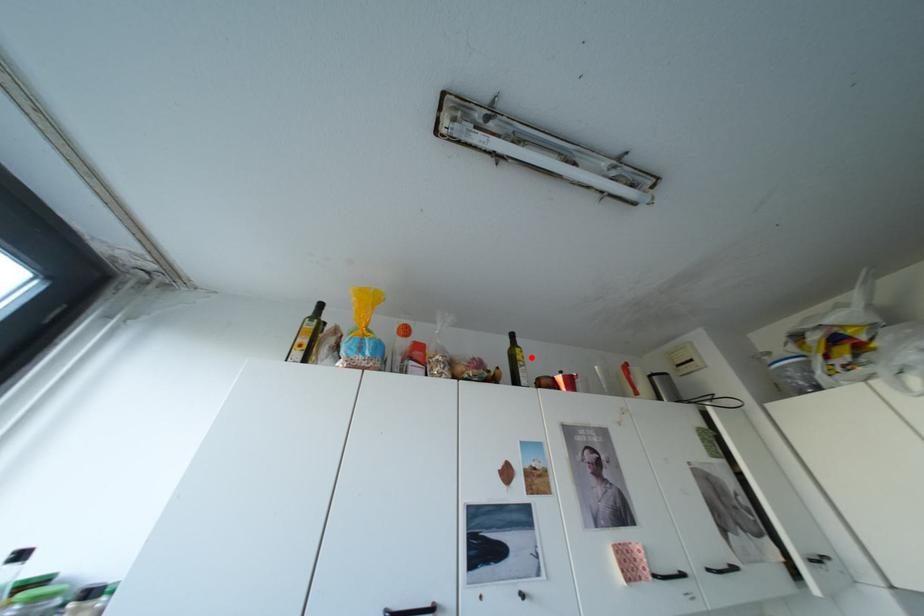
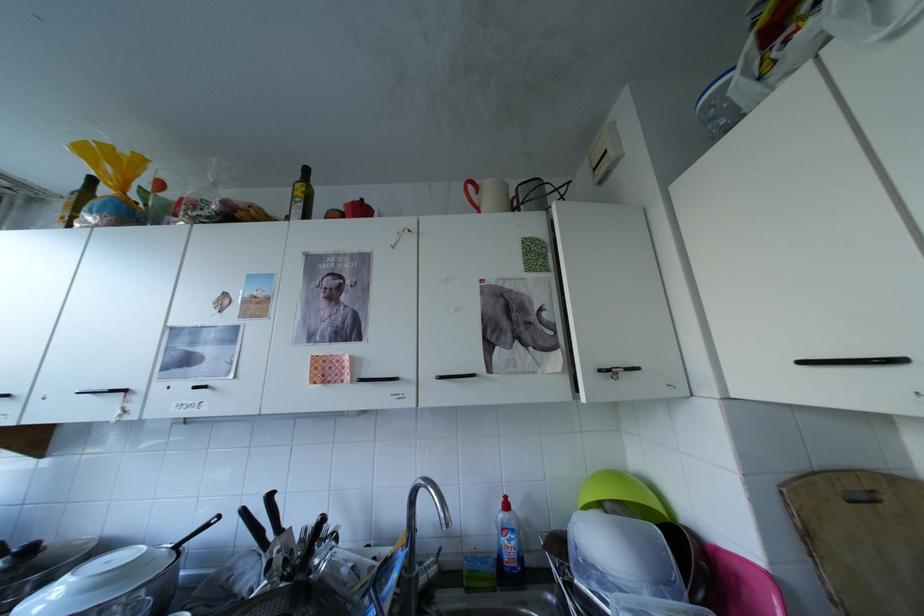
In the second image, find the point that corresponds to the highlighted location in the first image.

(309, 193)